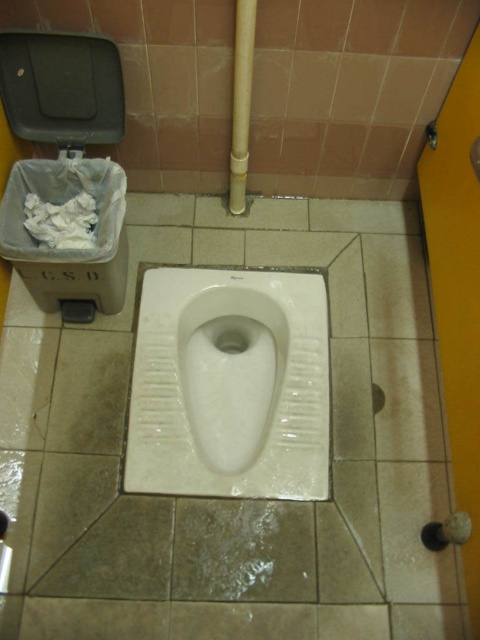
You are a maintenance worker checking the restroom layout. The white ceramic urinal at center is located at point (274, 401). Is the white ceramic urinal at center positioned closer to the front edge of the squat toilet or the back edge?

The point (274, 401) indicates the white ceramic urinal at center is positioned closer to the front edge of the squat toilet.

You are a maintenance worker inspecting the restroom facilities. You need to check both the white ceramic urinal at center and the white glossy toilet bowl at center. Which one should you check first if you want to start with the one located to the left?

You should check the white ceramic urinal at center first because it is located to the left of the white glossy toilet bowl at center.

You are a maintenance worker inspecting the public restroom. You need to access the black plastic lid at upper left to perform repairs. Can you reach it without moving the white glossy toilet bowl at center?

The black plastic lid at upper left is behind the white glossy toilet bowl at center, so you can reach it without moving the toilet bowl.